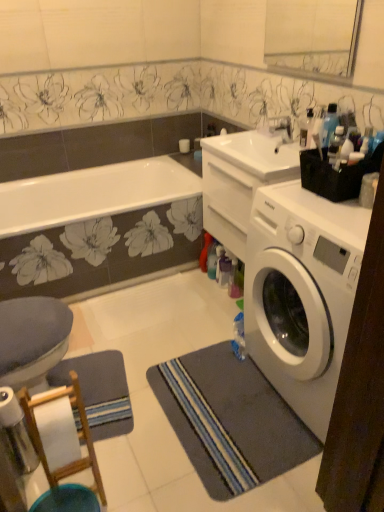
The width and height of the screenshot is (384, 512). What are the coordinates of `free space to the left of white glossy faucet at upper center` in the screenshot? It's located at pyautogui.click(x=244, y=142).